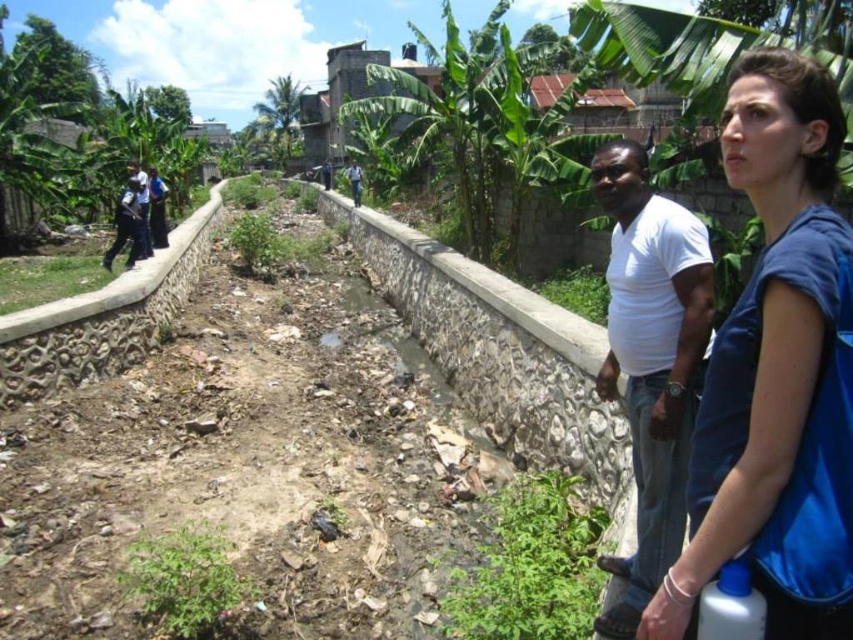
What do you see at coordinates (355, 180) in the screenshot?
I see `white cotton shirt at center` at bounding box center [355, 180].

Identify the location of white cotton shirt at center. This screenshot has height=640, width=853. (355, 180).

Between dark blue uniform at upper left and dark blue shirt at center, which one is positioned lower?

dark blue uniform at upper left is below.

Which is more to the left, dark blue uniform at upper left or dark blue shirt at center?

dark blue uniform at upper left

At what (x,y) coordinates should I click in order to perform the action: click on dark blue uniform at upper left. Please return your answer as a coordinate pair (x, y). The image size is (853, 640). Looking at the image, I should click on (141, 209).

Where is `dark blue uniform at upper left`? Image resolution: width=853 pixels, height=640 pixels. dark blue uniform at upper left is located at coordinates (141, 209).

Who is more distant from viewer, (x=618, y=154) or (x=138, y=225)?

The point (x=138, y=225) is more distant.

Can you confirm if white matte shirt at center is positioned above dark blue uniform at upper left?

No, white matte shirt at center is not above dark blue uniform at upper left.

Who is more forward, (674, 349) or (141, 168)?

Positioned in front is point (674, 349).

Find the location of a particular element. The image size is (853, 640). white matte shirt at center is located at coordinates (651, 360).